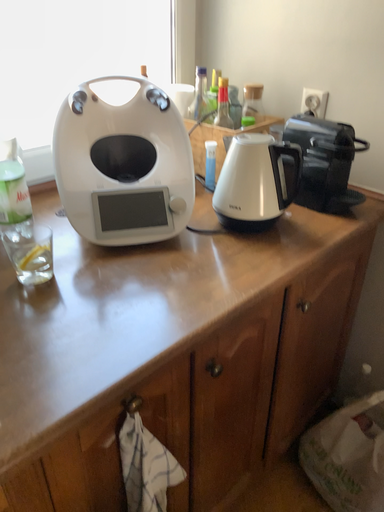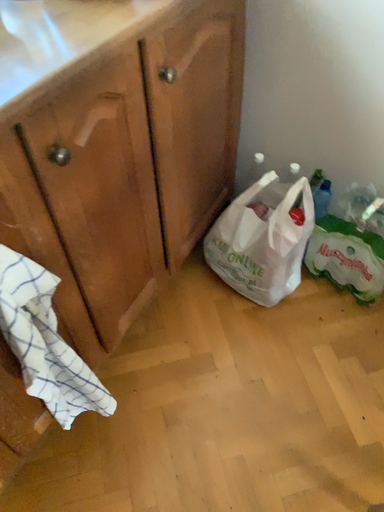
Question: How did the camera likely rotate when shooting the video?

Choices:
 (A) rotated downward
 (B) rotated upward

Answer: (A)